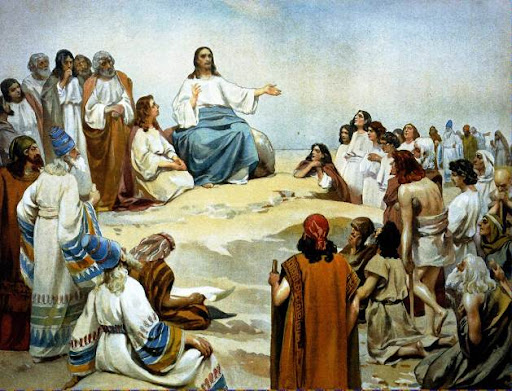
You are a GUI agent. You are given a task and a screenshot of the screen. Output one action in this format:
    pyautogui.click(x=<x>, y=<y>)
    Task: Click on the brown drapes
    
    Given the screenshot: What is the action you would take?
    pyautogui.click(x=306, y=311), pyautogui.click(x=156, y=282), pyautogui.click(x=14, y=191), pyautogui.click(x=110, y=147)